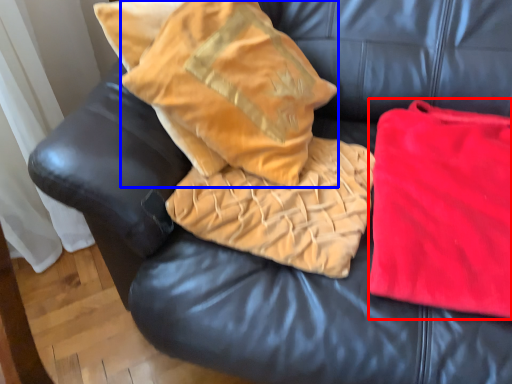
Question: Which point is further to the camera, material (highlighted by a red box) or throw pillow (highlighted by a blue box)?

Choices:
 (A) material
 (B) throw pillow

Answer: (B)